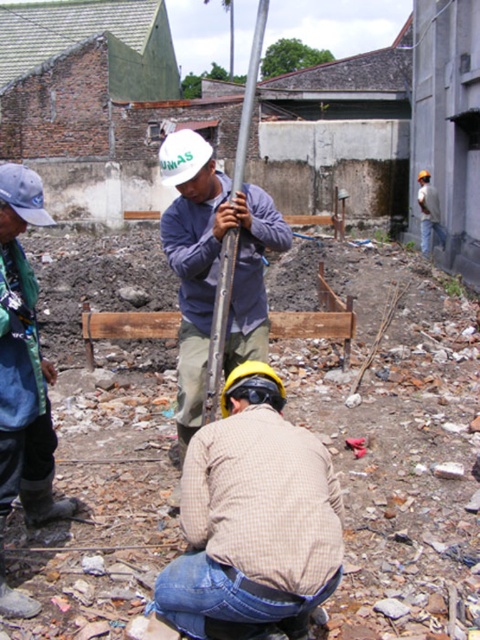
Question: Which of the following is the farthest from the observer?

Choices:
 (A) (239, 477)
 (B) (188, 236)
 (C) (420, 184)

Answer: (C)

Question: Is blue rubber boots at lower left to the right of blue fabric cap at upper left from the viewer's perspective?

Choices:
 (A) yes
 (B) no

Answer: (A)

Question: Where is checkered fabric shirt at center located in relation to blue rubber boots at lower left in the image?

Choices:
 (A) right
 (B) left

Answer: (A)

Question: Can you confirm if white matte hardhat at center is positioned below light gray concrete worker at upper right?

Choices:
 (A) yes
 (B) no

Answer: (B)

Question: Which point appears farthest from the camera in this image?

Choices:
 (A) (213, 282)
 (B) (256, 582)
 (C) (48, 486)

Answer: (A)

Question: Which of these objects is positioned closest to the metallic pole at center?

Choices:
 (A) light gray concrete worker at upper right
 (B) blue fabric cap at upper left

Answer: (A)